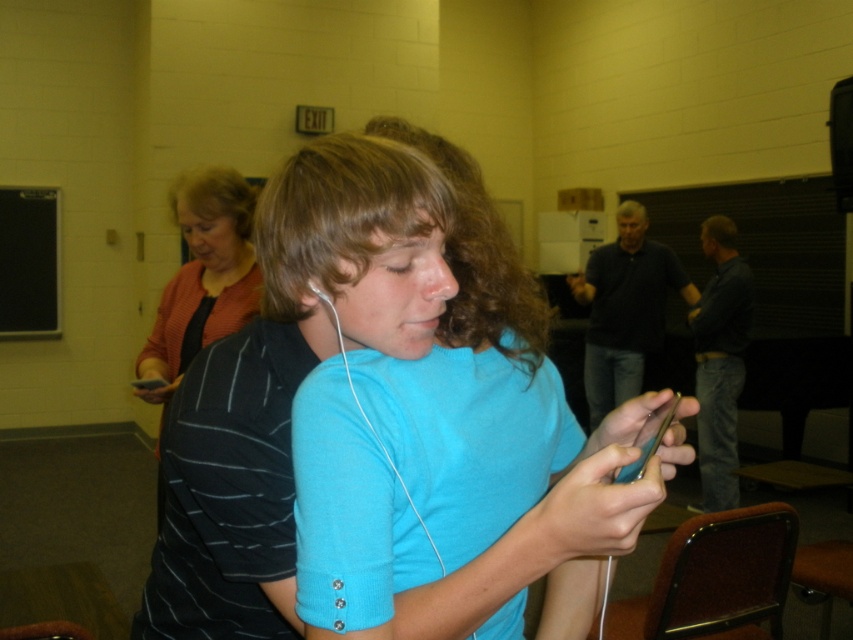
You are a photographer standing in the classroom. You want to take a photo of the dark blue shirt at right and the dark brown curly hair at upper center so both are clearly visible. Is there any issue with their positions?

The dark blue shirt at right is in front of dark brown curly hair at upper center, so the dark blue shirt at right may block the view of the dark brown curly hair at upper center in the photo.

You are a photographer trying to capture a candid shot of the blue matte shirt at center and the dark blue sweater at center in the classroom scene. Which clothing item will appear larger in your photo?

The blue matte shirt at center will appear larger in the photo because it is closer to the viewer than the dark blue sweater at center.

You are standing in the classroom and need to locate the dark blue shirt at right and the dark brown curly hair at upper center. Which object is positioned further to the left?

The dark blue shirt at right is to the left of dark brown curly hair at upper center, so the dark blue shirt at right is positioned further to the left.